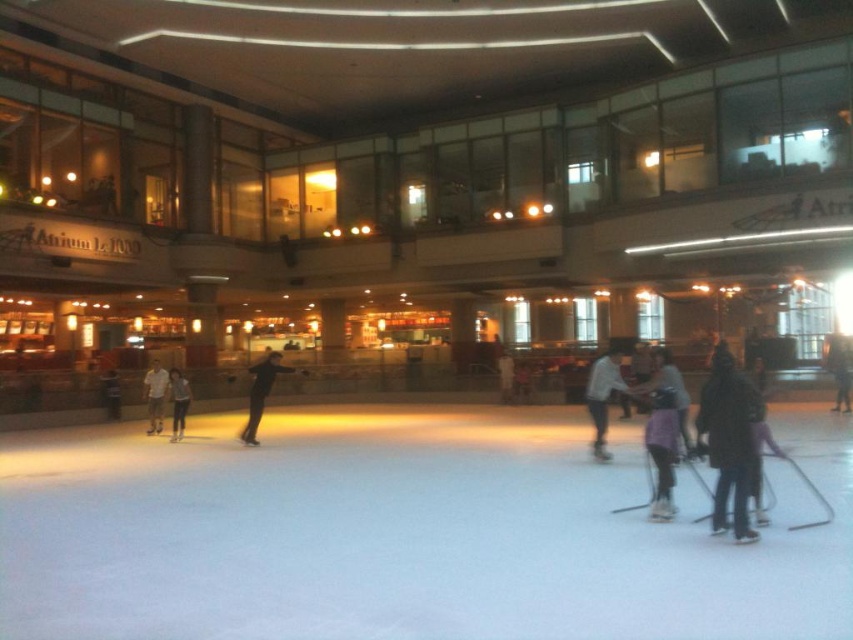
You are standing at the point marked as point (665, 355) in the image. If you want to move towards the glass walls surrounding the ice rink, which direction should you go?

Since the point (665, 355) is 8.53 meters away from the viewer, you should move forward to reach the glass walls surrounding the ice rink.

You are a photographer positioned at the edge of the ice rink. You want to capture a photo of the black matte jacket at lower right and denim pants at center in the same frame. Which object should you adjust your camera angle to focus on first to ensure both are in the frame?

The black matte jacket at lower right might be wider than denim pants at center, so you should focus on the black matte jacket at lower right first to accommodate its width in the frame.